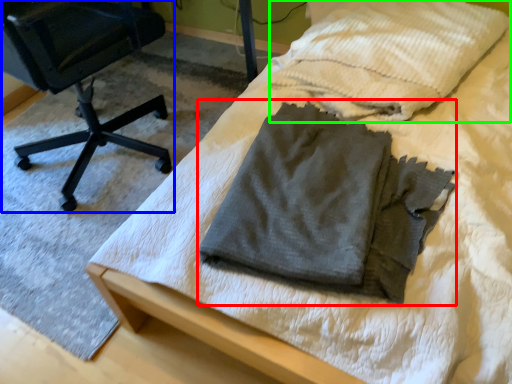
Question: Based on their relative distances, which object is nearer to laundry (highlighted by a red box)? Choose from chair (highlighted by a blue box) and cloth (highlighted by a green box).

Choices:
 (A) chair
 (B) cloth

Answer: (B)